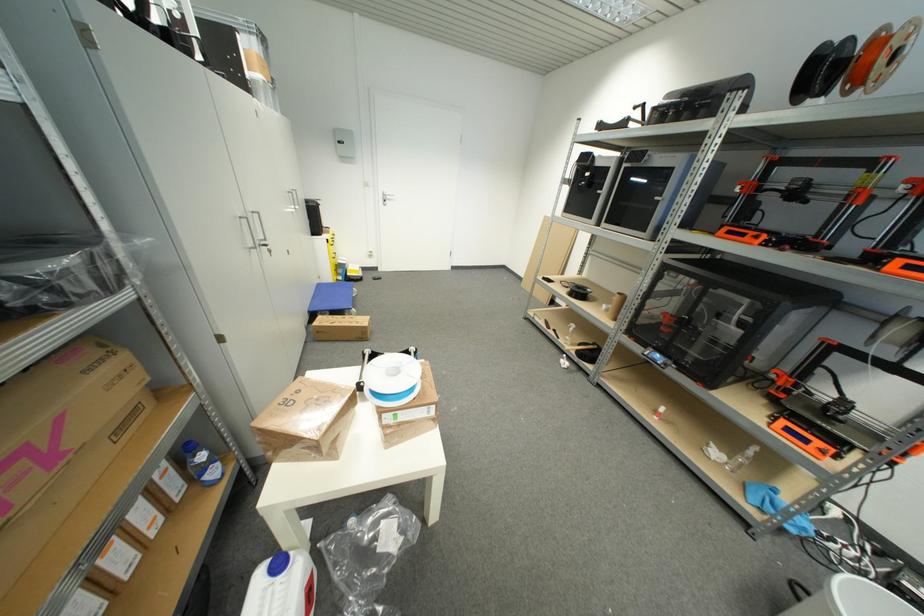
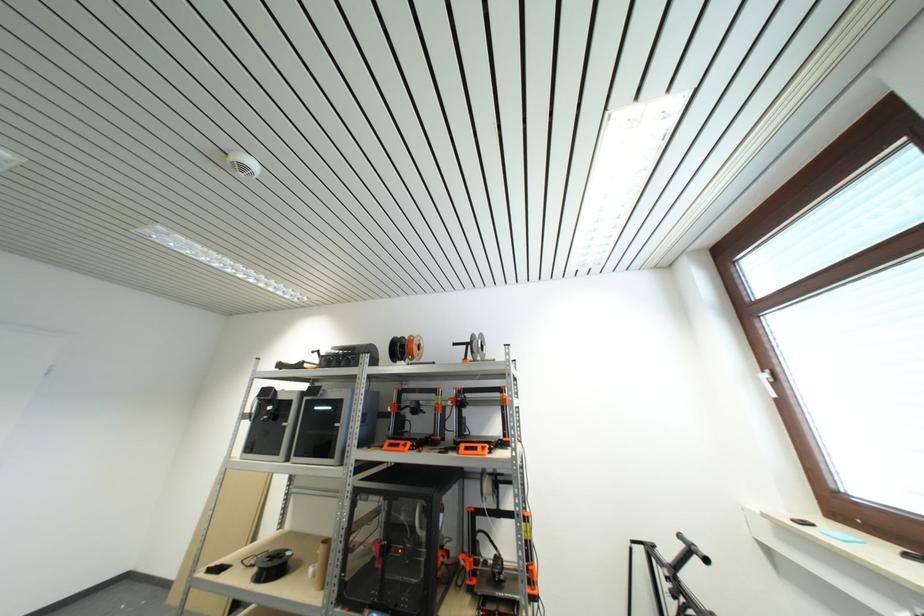
In the second image, find the point that corresponds to pixel 609 309 in the first image.

(314, 573)